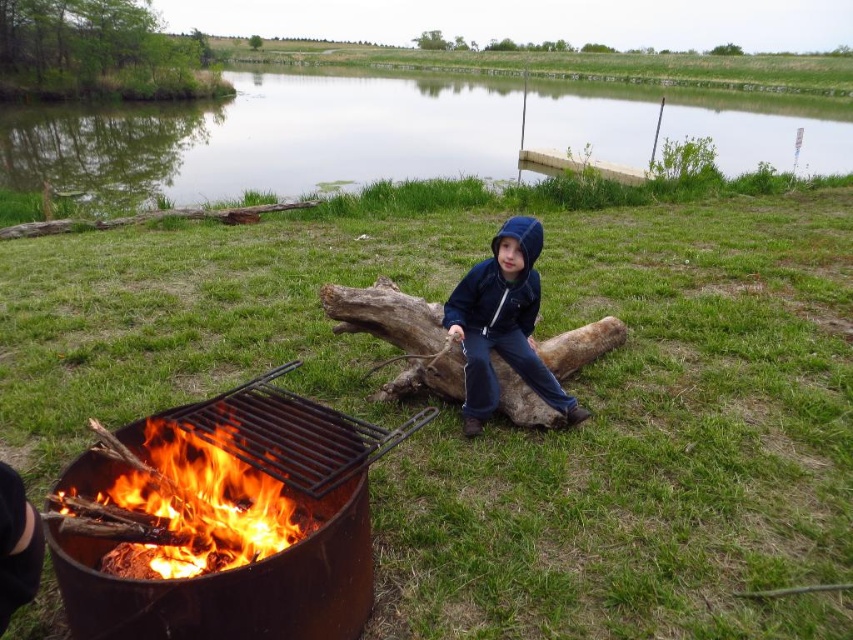
You are a parent supervising a child sitting on the brown rough wood log at center. You notice the rusty metal fire pit at lower left. To ensure the child stays safe, which object should you position the child closer to and which should you keep them away from?

You should keep the child away from the rusty metal fire pit at lower left and position them closer to the brown rough wood log at center since the fire pit is on the left side of the log, meaning it is farther from the child if they are seated on the log.

You are standing in the outdoor scene by the water. There are two points marked in the image. Which point is closer to you? The points are labeled as point 1 at coordinates point [142,529] and point 2 at coordinates point [415,340]. Please answer with the point number.

Point 1 at coordinates point [142,529] is closer to the viewer than point 2 at coordinates point [415,340].

You are planning to build a small campfire using the flaming wood at lower left and the brown rough wood log at center. Which object would you choose as the base for the fire pit and why?

The brown rough wood log at center would be the better choice as the base for the fire pit because it occupies more space than the flaming wood at lower left, providing a more stable and larger foundation for the fire.